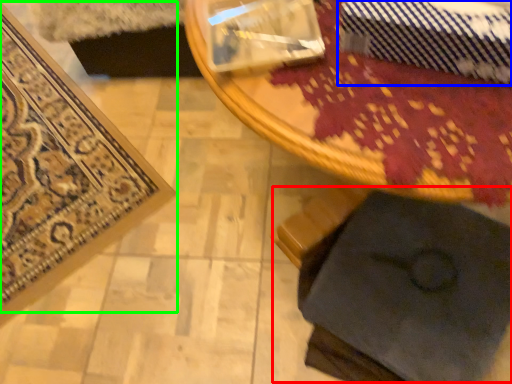
Question: Which object is positioned closest to swivel chair (highlighted by a red box)? Select from tie (highlighted by a blue box) and mat (highlighted by a green box).

Choices:
 (A) tie
 (B) mat

Answer: (A)